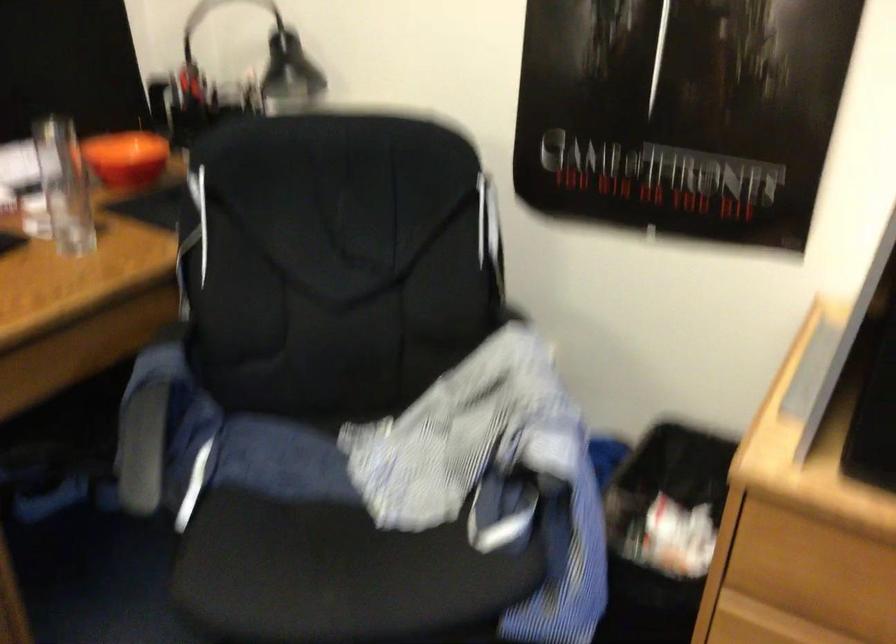
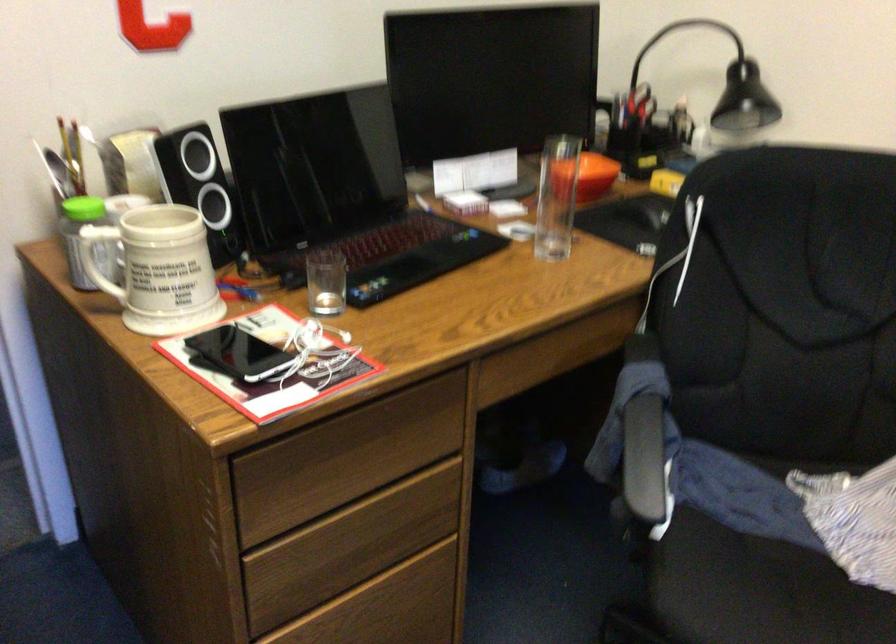
Find the pixel in the second image that matches [152,428] in the first image.

(642, 442)